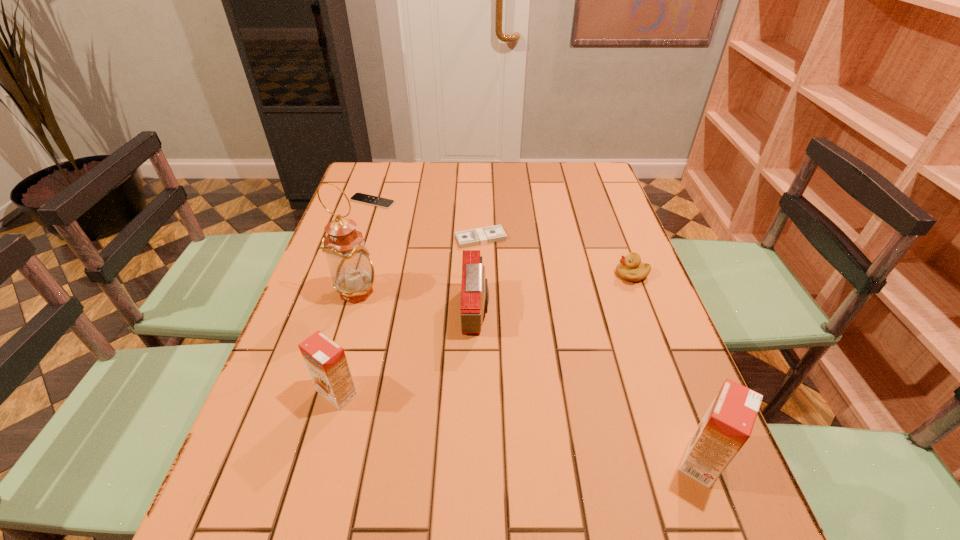
Locate an element on the screen. spot to insert another orange_juice for uniform distribution is located at coordinates (508, 424).